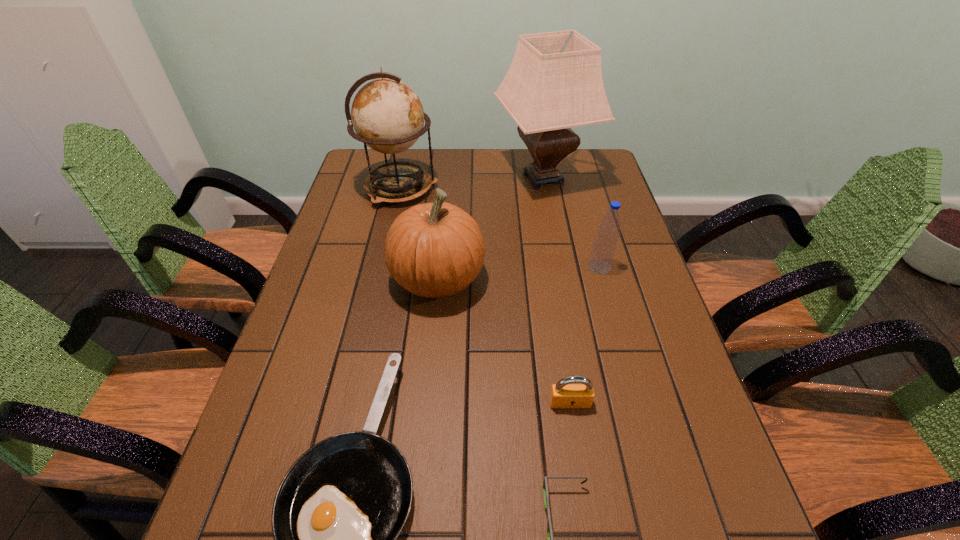
Locate an element on the screen. free space between the third shortest object and the water bottle is located at coordinates click(585, 335).

Where is `vacant area between the fifth shortest object and the lampshade`? vacant area between the fifth shortest object and the lampshade is located at coordinates (491, 228).

Locate an element on the screen. The height and width of the screenshot is (540, 960). free spot between the lampshade and the padlock is located at coordinates (557, 291).

Where is `free space between the lampshade and the globe`? free space between the lampshade and the globe is located at coordinates (471, 184).

Where is `object that is the fourth closest to the pumpkin`? object that is the fourth closest to the pumpkin is located at coordinates (564, 394).

The width and height of the screenshot is (960, 540). In order to click on object that is the fourth closest to the lampshade in this screenshot , I will do `click(338, 511)`.